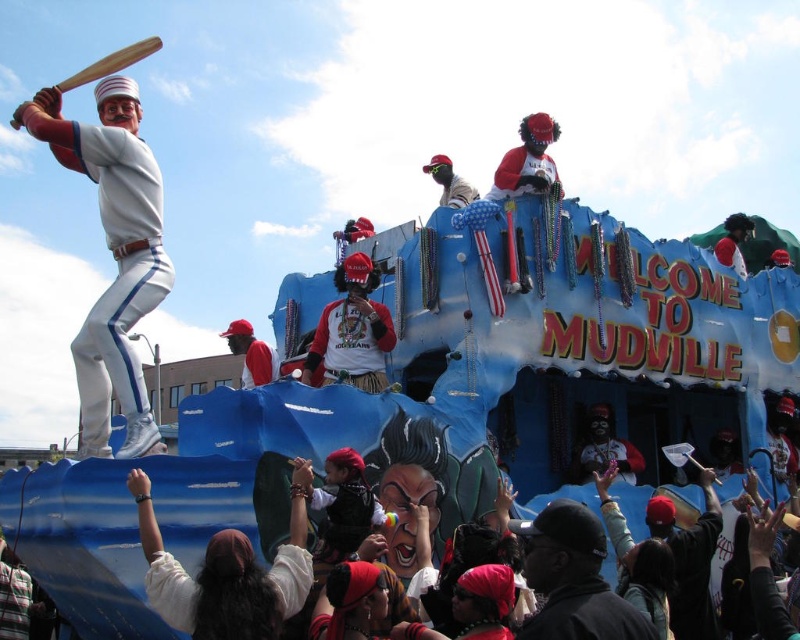
Question: Can you confirm if white matte baseball bat at left is smaller than wooden baseball bat at upper left?

Choices:
 (A) yes
 (B) no

Answer: (A)

Question: Is the position of reddish-brown leather jacket at center less distant than that of matte red cap at center?

Choices:
 (A) no
 (B) yes

Answer: (B)

Question: Which point appears closest to the camera in this image?

Choices:
 (A) (136, 163)
 (B) (344, 321)

Answer: (A)

Question: Does black matte baseball cap at lower center appear over wooden baseball bat at upper left?

Choices:
 (A) no
 (B) yes

Answer: (A)

Question: Estimate the real-world distances between objects in this image. Which object is farther from the wooden baseball bat at upper left?

Choices:
 (A) reddish-brown leather jacket at center
 (B) white matte baseball bat at left
 (C) black matte baseball cap at lower center

Answer: (C)

Question: Which is nearer to the reddish-brown leather jacket at center?

Choices:
 (A) black matte baseball cap at lower center
 (B) white matte baseball bat at left
 (C) wooden baseball bat at upper left
 (D) matte red cap at center

Answer: (D)